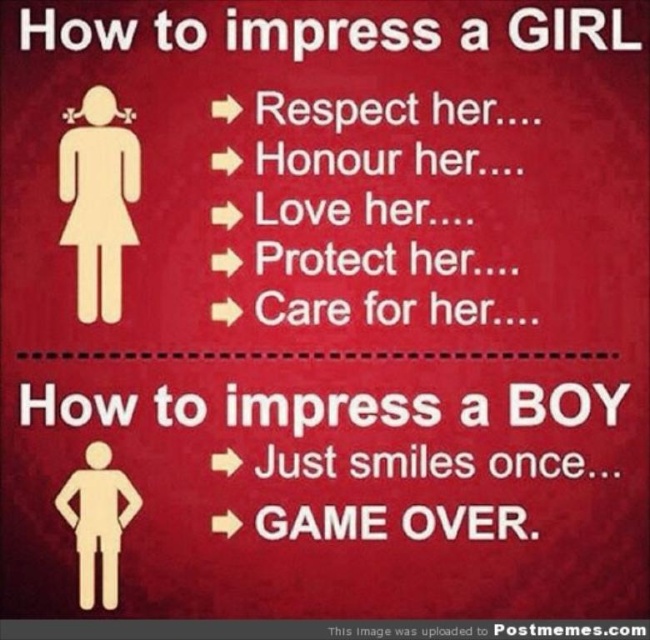
Question: Which point is closer to the camera taking this photo?

Choices:
 (A) (127, 490)
 (B) (60, 196)

Answer: (A)

Question: Observing the image, what is the correct spatial positioning of wooden figure at upper left in reference to white paper man at center?

Choices:
 (A) above
 (B) below

Answer: (A)

Question: Can you confirm if wooden figure at upper left is positioned to the right of white paper man at center?

Choices:
 (A) no
 (B) yes

Answer: (B)

Question: Can you confirm if wooden figure at upper left is positioned to the left of white paper man at center?

Choices:
 (A) yes
 (B) no

Answer: (B)

Question: Among these points, which one is farthest from the camera?

Choices:
 (A) (58, 179)
 (B) (124, 518)

Answer: (A)